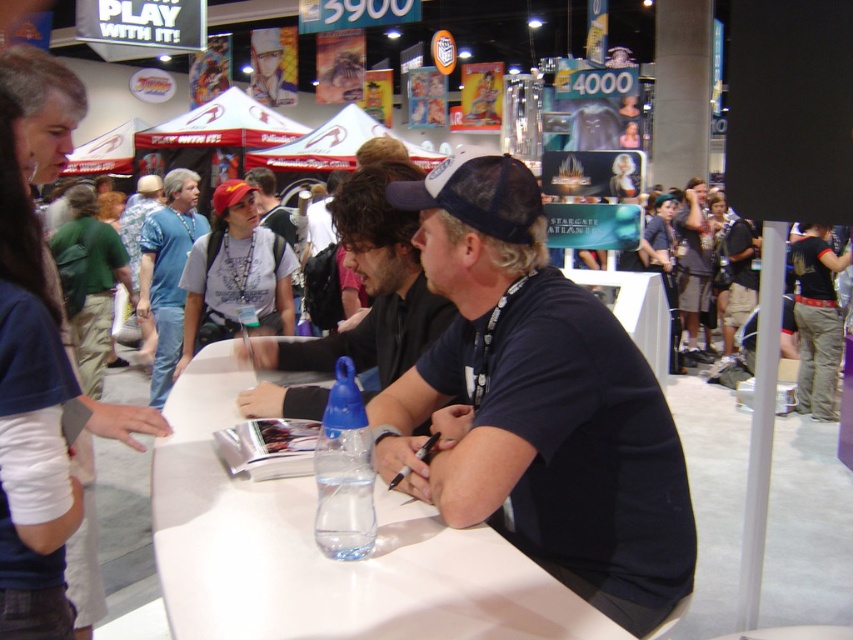
Between point (480, 202) and point (201, 369), which one is positioned behind?

The point (201, 369) is behind.

Measure the distance between point (529, 488) and camera.

Point (529, 488) is 4.75 feet from camera.

This screenshot has width=853, height=640. I want to click on black mesh cap at center, so (537, 403).

Does black matte cap at center lie in front of denim shorts at right?

That is True.

Between black matte cap at center and denim shorts at right, which one is positioned higher?

denim shorts at right is above.

Which is behind, point (393, 260) or point (706, 234)?

The point (706, 234) is behind.

Image resolution: width=853 pixels, height=640 pixels. Identify the location of black matte cap at center. (370, 285).

Which of these two, black mesh cap at center or denim shorts at right, stands taller?

denim shorts at right is taller.

Does black mesh cap at center have a lesser width compared to denim shorts at right?

Yes, black mesh cap at center is thinner than denim shorts at right.

Is point (527, 445) positioned in front of point (701, 273)?

Yes, point (527, 445) is closer to viewer.

At what (x,y) coordinates should I click in order to perform the action: click on black mesh cap at center. Please return your answer as a coordinate pair (x, y). Looking at the image, I should click on (537, 403).